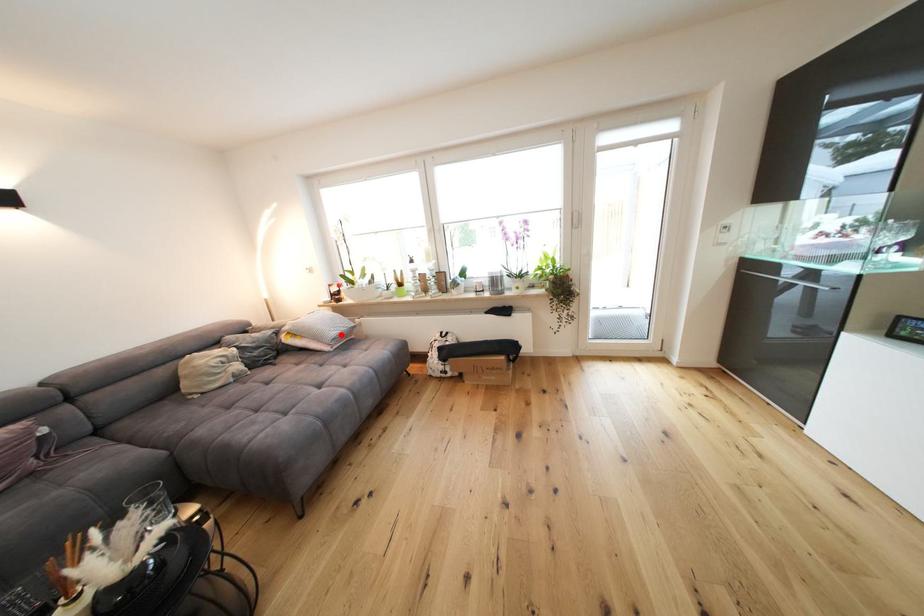
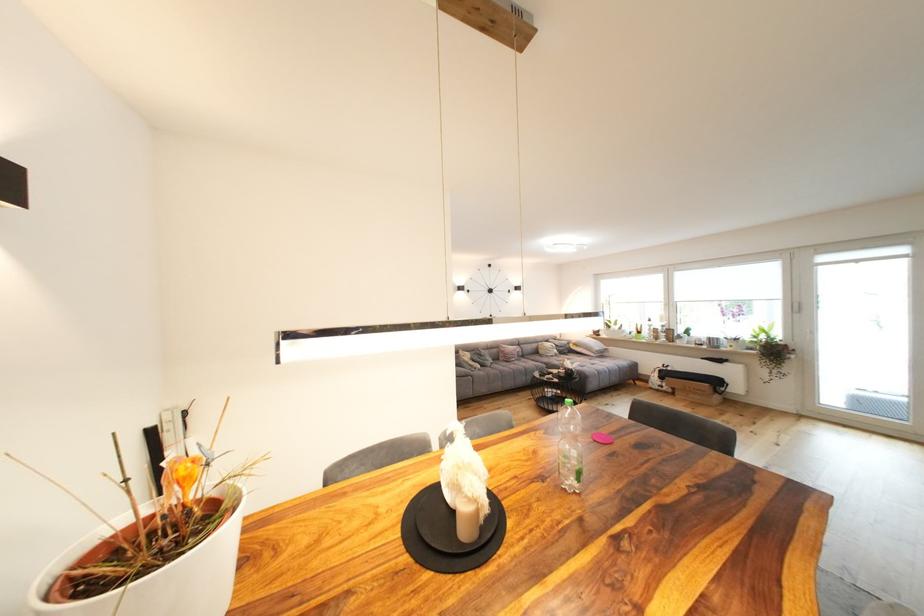
Find the pixel in the second image that matches the highlighted location in the first image.

(603, 350)